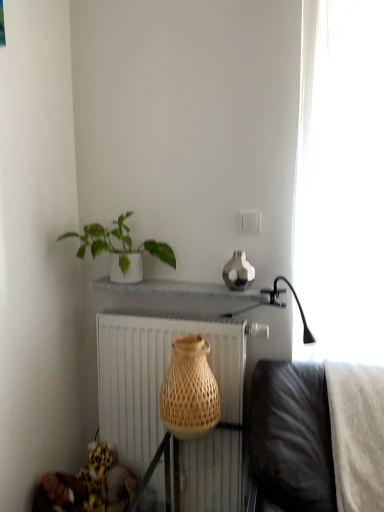
Question: Is white sheer curtain at right beside white matte radiator at center?

Choices:
 (A) no
 (B) yes

Answer: (A)

Question: Considering the relative sizes of white sheer curtain at right and white matte radiator at center in the image provided, is white sheer curtain at right shorter than white matte radiator at center?

Choices:
 (A) no
 (B) yes

Answer: (A)

Question: Considering the relative sizes of white sheer curtain at right and white matte radiator at center in the image provided, is white sheer curtain at right wider than white matte radiator at center?

Choices:
 (A) yes
 (B) no

Answer: (A)

Question: Is white sheer curtain at right to the left of white matte radiator at center from the viewer's perspective?

Choices:
 (A) yes
 (B) no

Answer: (B)

Question: From a real-world perspective, does white sheer curtain at right stand above white matte radiator at center?

Choices:
 (A) yes
 (B) no

Answer: (A)

Question: Does white sheer curtain at right have a smaller size compared to white matte radiator at center?

Choices:
 (A) no
 (B) yes

Answer: (A)

Question: Can you confirm if natural woven basket at center is taller than white ceramic plant at upper left?

Choices:
 (A) yes
 (B) no

Answer: (A)

Question: Does natural woven basket at center have a smaller size compared to white ceramic plant at upper left?

Choices:
 (A) yes
 (B) no

Answer: (A)

Question: Is natural woven basket at center bigger than white ceramic plant at upper left?

Choices:
 (A) yes
 (B) no

Answer: (B)

Question: Is natural woven basket at center closer to camera compared to white ceramic plant at upper left?

Choices:
 (A) yes
 (B) no

Answer: (A)

Question: From the image's perspective, does natural woven basket at center appear lower than white ceramic plant at upper left?

Choices:
 (A) yes
 (B) no

Answer: (A)

Question: Is natural woven basket at center looking in the opposite direction of white ceramic plant at upper left?

Choices:
 (A) yes
 (B) no

Answer: (B)

Question: Is natural woven basket at center at the back of white sheer curtain at right?

Choices:
 (A) yes
 (B) no

Answer: (B)